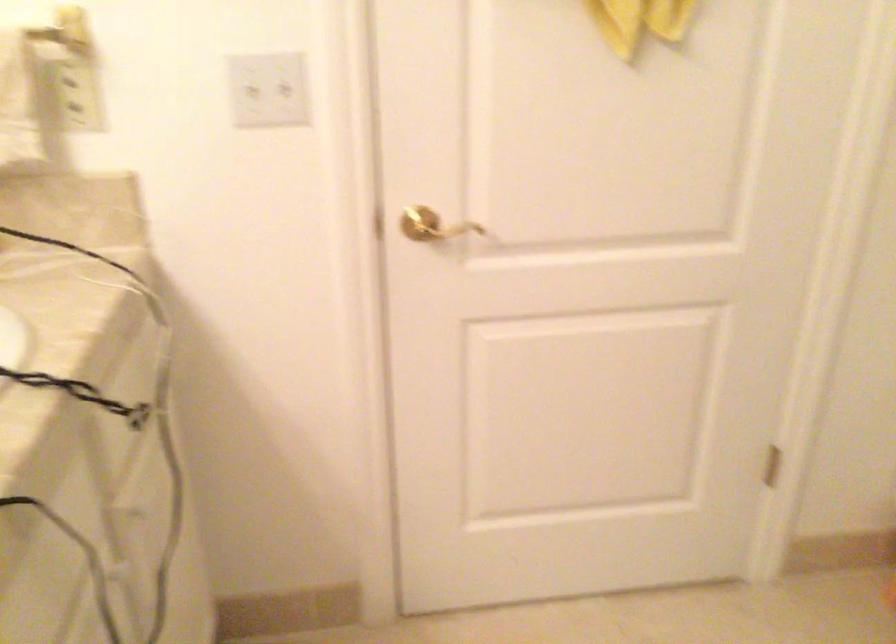
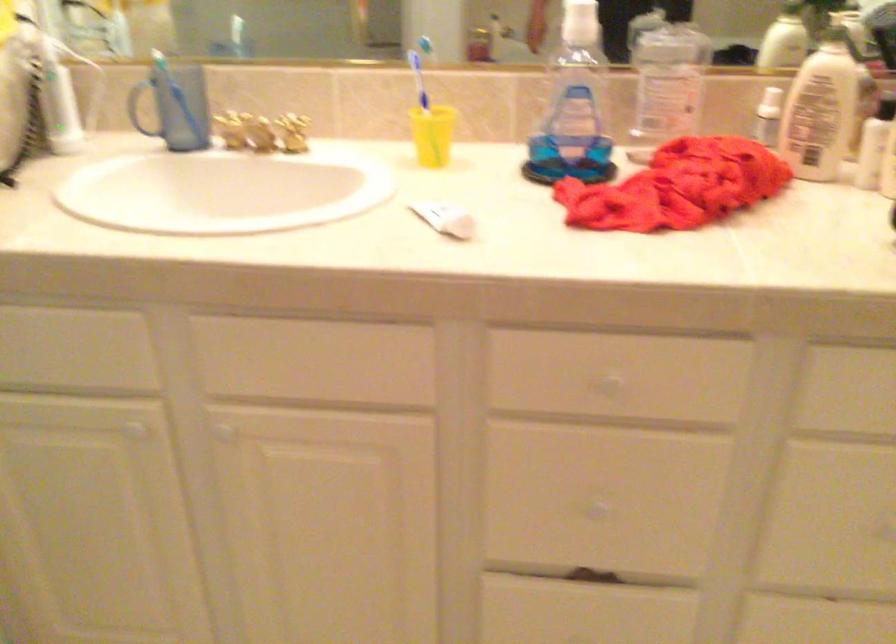
The images are taken continuously from a first-person perspective. In which direction is your viewpoint rotating?

The camera's rotation is toward left-down.